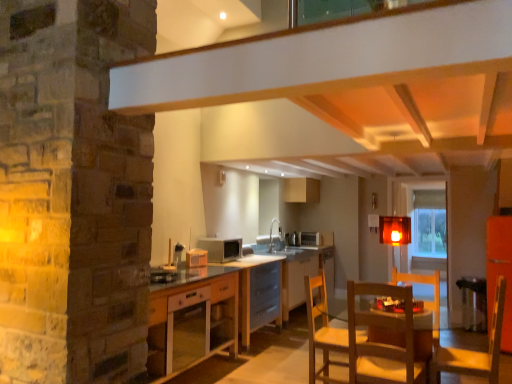
Question: Considering the relative positions of wooden table at center, placed as the first table when sorted from front to back, and metallic silver bar stool at lower right in the image provided, is wooden table at center, placed as the first table when sorted from front to back, to the left of metallic silver bar stool at lower right from the viewer's perspective?

Choices:
 (A) yes
 (B) no

Answer: (A)

Question: Considering the relative sizes of wooden table at center, placed as the first table when sorted from front to back, and metallic silver bar stool at lower right in the image provided, is wooden table at center, placed as the first table when sorted from front to back, taller than metallic silver bar stool at lower right?

Choices:
 (A) yes
 (B) no

Answer: (A)

Question: From a real-world perspective, is wooden table at center, which ranks as the second table in back-to-front order, physically below metallic silver bar stool at lower right?

Choices:
 (A) no
 (B) yes

Answer: (A)

Question: Are wooden table at center, placed as the first table when sorted from front to back, and metallic silver bar stool at lower right located far from each other?

Choices:
 (A) yes
 (B) no

Answer: (A)

Question: From the image's perspective, is wooden table at center, placed as the first table when sorted from front to back, over metallic silver bar stool at lower right?

Choices:
 (A) no
 (B) yes

Answer: (B)

Question: Is point (468, 283) positioned closer to the camera than point (352, 107)?

Choices:
 (A) closer
 (B) farther

Answer: (B)

Question: From the image's perspective, is metallic silver bar stool at lower right positioned above or below white matte exhaust hood at upper center?

Choices:
 (A) above
 (B) below

Answer: (B)

Question: Is metallic silver bar stool at lower right in front of or behind white matte exhaust hood at upper center in the image?

Choices:
 (A) behind
 (B) front

Answer: (A)

Question: Considering the positions of metallic silver bar stool at lower right and white matte exhaust hood at upper center in the image, is metallic silver bar stool at lower right taller or shorter than white matte exhaust hood at upper center?

Choices:
 (A) short
 (B) tall

Answer: (B)

Question: Looking at the image, does white matte exhaust hood at upper center seem bigger or smaller compared to translucent amber cube at center?

Choices:
 (A) small
 (B) big

Answer: (B)

Question: Considering the positions of point (364, 72) and point (410, 231), is point (364, 72) closer or farther from the camera than point (410, 231)?

Choices:
 (A) closer
 (B) farther

Answer: (A)

Question: From the image's perspective, is white matte exhaust hood at upper center positioned above or below translucent amber cube at center?

Choices:
 (A) above
 (B) below

Answer: (A)

Question: From their relative heights in the image, would you say white matte exhaust hood at upper center is taller or shorter than translucent amber cube at center?

Choices:
 (A) short
 (B) tall

Answer: (A)

Question: Considering the positions of metallic silver bar stool at lower right and wooden cabinet at lower center in the image, is metallic silver bar stool at lower right bigger or smaller than wooden cabinet at lower center?

Choices:
 (A) big
 (B) small

Answer: (B)

Question: Would you say metallic silver bar stool at lower right is to the left or to the right of wooden cabinet at lower center in the picture?

Choices:
 (A) left
 (B) right

Answer: (B)